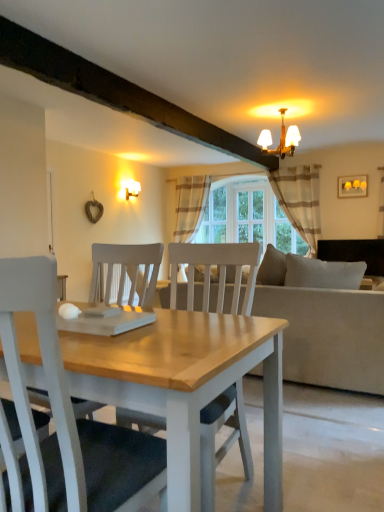
Question: Does matte white wall sconce at upper left, the second lamp from the front, have a lesser width compared to clear glass door at center?

Choices:
 (A) no
 (B) yes

Answer: (A)

Question: Is matte white wall sconce at upper left, which is the 1th lamp from back to front, to the left of clear glass door at center from the viewer's perspective?

Choices:
 (A) yes
 (B) no

Answer: (A)

Question: Is matte white wall sconce at upper left, the second lamp from the front, positioned with its back to clear glass door at center?

Choices:
 (A) yes
 (B) no

Answer: (B)

Question: Does matte white wall sconce at upper left, which is counted as the first lamp, starting from the left, appear on the right side of clear glass door at center?

Choices:
 (A) yes
 (B) no

Answer: (B)

Question: Does matte white wall sconce at upper left, which is counted as the first lamp, starting from the left, have a smaller size compared to clear glass door at center?

Choices:
 (A) no
 (B) yes

Answer: (B)

Question: From the image's perspective, relative to beige striped fabric curtain at upper right, marked as the 1th curtain in a front-to-back arrangement, is brown striped curtain at center, the 1th curtain viewed from the left, above or below?

Choices:
 (A) below
 (B) above

Answer: (B)

Question: Is brown striped curtain at center, which is counted as the first curtain, starting from the back, to the left or to the right of beige striped fabric curtain at upper right, which is the first curtain in right-to-left order, in the image?

Choices:
 (A) left
 (B) right

Answer: (A)

Question: Considering the positions of brown striped curtain at center, placed as the 2th curtain when sorted from front to back, and beige striped fabric curtain at upper right, placed as the 2th curtain when sorted from back to front, in the image, is brown striped curtain at center, placed as the 2th curtain when sorted from front to back, wider or thinner than beige striped fabric curtain at upper right, placed as the 2th curtain when sorted from back to front,?

Choices:
 (A) wide
 (B) thin

Answer: (A)

Question: Is brown striped curtain at center, which is counted as the first curtain, starting from the back, in front of or behind beige striped fabric curtain at upper right, placed as the 2th curtain when sorted from back to front, in the image?

Choices:
 (A) behind
 (B) front

Answer: (A)

Question: Considering the positions of beige fabric couch at center and brown striped curtain at center, placed as the 2th curtain when sorted from front to back, in the image, is beige fabric couch at center taller or shorter than brown striped curtain at center, placed as the 2th curtain when sorted from front to back,?

Choices:
 (A) short
 (B) tall

Answer: (A)

Question: Which is correct: beige fabric couch at center is inside brown striped curtain at center, the second curtain positioned from the right, or outside of it?

Choices:
 (A) inside
 (B) outside

Answer: (B)

Question: Is beige fabric couch at center wider or thinner than brown striped curtain at center, which is counted as the first curtain, starting from the back?

Choices:
 (A) wide
 (B) thin

Answer: (A)

Question: From the image's perspective, is beige fabric couch at center located above or below brown striped curtain at center, the second curtain positioned from the right?

Choices:
 (A) above
 (B) below

Answer: (B)

Question: From the image's perspective, is brown striped curtain at center, the second curtain positioned from the right, positioned above or below matte white wall sconce at upper left, positioned as the 2th lamp in right-to-left order?

Choices:
 (A) above
 (B) below

Answer: (B)

Question: Is brown striped curtain at center, the 1th curtain viewed from the left, wider or thinner than matte white wall sconce at upper left, positioned as the 2th lamp in right-to-left order?

Choices:
 (A) wide
 (B) thin

Answer: (A)